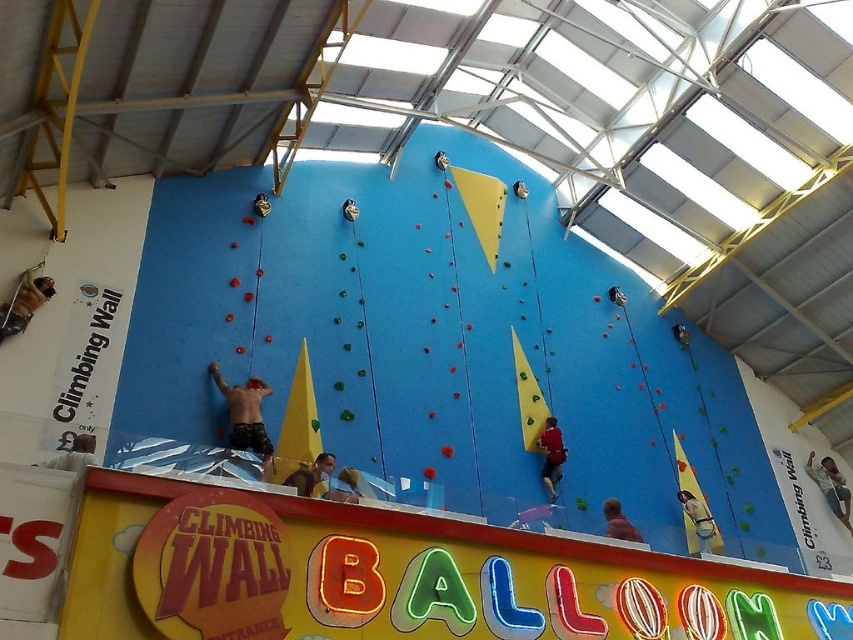
Question: Among these points, which one is farthest from the camera?

Choices:
 (A) (347, 483)
 (B) (709, 524)

Answer: (B)

Question: Considering the relative positions of shiny metallic shorts at center and light blue shirt at upper center in the image provided, where is shiny metallic shorts at center located with respect to light blue shirt at upper center?

Choices:
 (A) above
 (B) below

Answer: (A)

Question: In this image, where is smooth brown shirt at center located relative to brown leather jacket at lower right?

Choices:
 (A) left
 (B) right

Answer: (A)

Question: Which of the following is the closest to the observer?

Choices:
 (A) (558, 461)
 (B) (54, 465)
 (C) (339, 477)
 (D) (215, 369)

Answer: (B)

Question: Which point is closer to the camera?

Choices:
 (A) matte red shirt at center
 (B) smooth skin person at center
 (C) shiny metallic shorts at center
 (D) light blue shirt at upper center

Answer: (B)

Question: Does matte yellow harness at center have a smaller size compared to brown leather jacket at lower right?

Choices:
 (A) yes
 (B) no

Answer: (B)